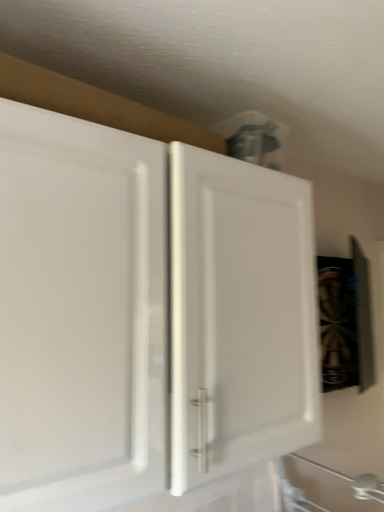
Identify the location of white matte cabinet at center. This screenshot has width=384, height=512. (146, 314).

What do you see at coordinates (146, 314) in the screenshot? I see `white matte cabinet at center` at bounding box center [146, 314].

Find the location of `white matte cabinet at center`. white matte cabinet at center is located at coordinates (146, 314).